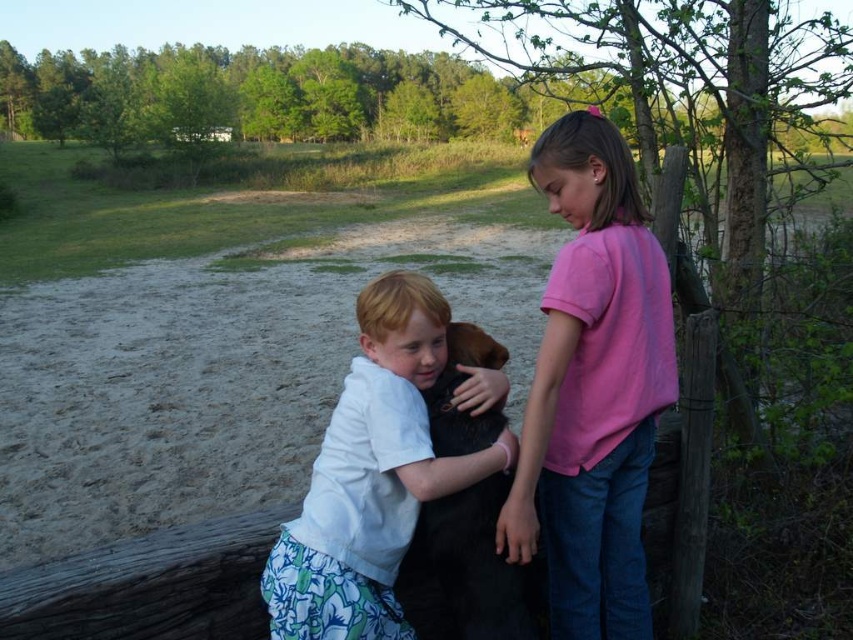
You are a photographer trying to capture a clear shot of the smooth white shirt at center and the black fur dog at center. Which object should you focus on first to ensure both are in focus?

Since the smooth white shirt at center is closer to the viewer than the black fur dog at center, you should focus on the smooth white shirt at center first. This way, adjusting the focus from near to far will help both objects come into clarity.